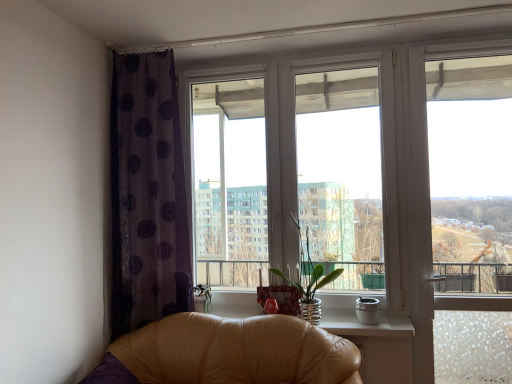
Question: Is clear glass vase at center positioned before purple sheer curtain at left?

Choices:
 (A) yes
 (B) no

Answer: (B)

Question: Is clear glass vase at center to the left of purple sheer curtain at left from the viewer's perspective?

Choices:
 (A) yes
 (B) no

Answer: (B)

Question: From the image's perspective, is clear glass vase at center located beneath purple sheer curtain at left?

Choices:
 (A) no
 (B) yes

Answer: (B)

Question: Can you confirm if clear glass vase at center is positioned to the right of purple sheer curtain at left?

Choices:
 (A) no
 (B) yes

Answer: (B)

Question: Could you tell me if clear glass vase at center is facing purple sheer curtain at left?

Choices:
 (A) no
 (B) yes

Answer: (A)

Question: Considering the positions of point (148, 193) and point (216, 360), is point (148, 193) closer or farther from the camera than point (216, 360)?

Choices:
 (A) farther
 (B) closer

Answer: (A)

Question: From the image's perspective, is purple sheer curtain at left positioned above or below leather chair at lower left?

Choices:
 (A) above
 (B) below

Answer: (A)

Question: From a real-world perspective, relative to leather chair at lower left, is purple sheer curtain at left vertically above or below?

Choices:
 (A) above
 (B) below

Answer: (A)

Question: In terms of size, does purple sheer curtain at left appear bigger or smaller than leather chair at lower left?

Choices:
 (A) small
 (B) big

Answer: (A)

Question: From their relative heights in the image, would you say transparent glass window at center is taller or shorter than clear glass window at upper right?

Choices:
 (A) tall
 (B) short

Answer: (B)

Question: Considering their positions, is transparent glass window at center located in front of or behind clear glass window at upper right?

Choices:
 (A) front
 (B) behind

Answer: (B)

Question: Looking at their shapes, would you say transparent glass window at center is wider or thinner than clear glass window at upper right?

Choices:
 (A) wide
 (B) thin

Answer: (A)

Question: Would you say transparent glass window at center is inside or outside clear glass window at upper right?

Choices:
 (A) outside
 (B) inside

Answer: (A)

Question: From the image's perspective, is clear glass vase at center above or below clear glass window at upper right?

Choices:
 (A) below
 (B) above

Answer: (A)

Question: In terms of width, does clear glass vase at center look wider or thinner when compared to clear glass window at upper right?

Choices:
 (A) wide
 (B) thin

Answer: (A)